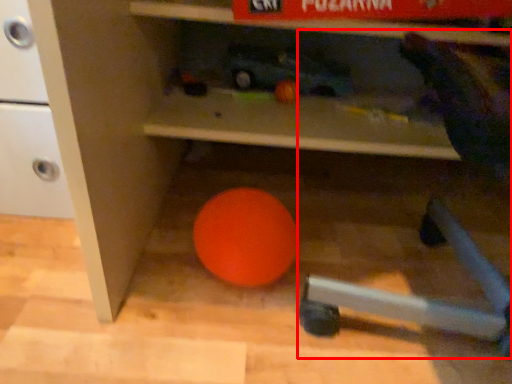
Question: Observing the image, what is the correct spatial positioning of bean bag chair (annotated by the red box) in reference to ball?

Choices:
 (A) right
 (B) left

Answer: (A)